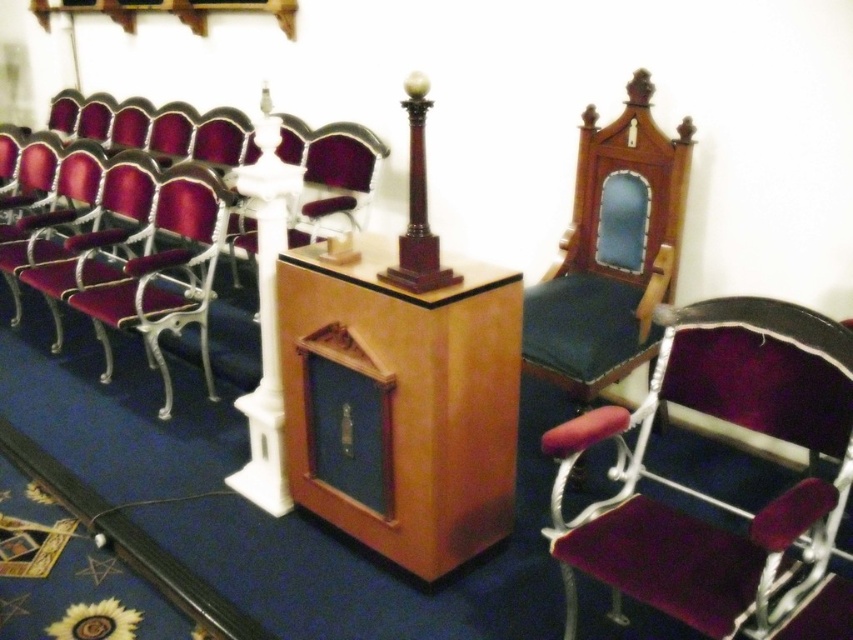
You are standing at the entrance of the room. Where is the wooden podium at center located in relation to the sun design on the blue carpet?

The wooden podium at center is located at point (399, 403), which is to the right and slightly forward of the sun design at the bottom left corner of the blue carpet.

You are a guest entering the room and need to sit in the velvet purple armchair at center. The white glossy column at center is in your path. Can you walk around it to reach the chair?

The velvet purple armchair at center is shorter than the white glossy column at center, so you can walk around the column to reach the chair since the column is taller and likely obstructs the direct path.